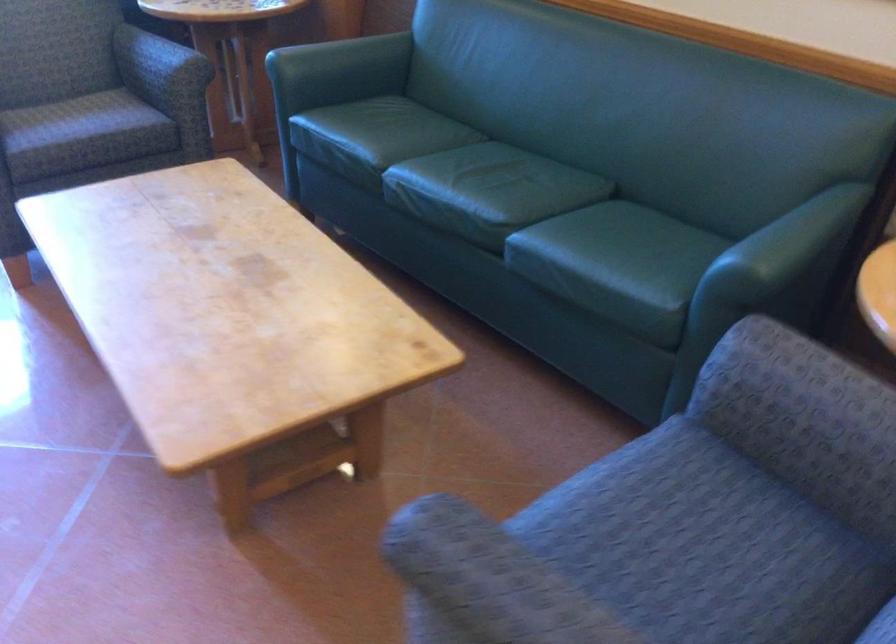
The height and width of the screenshot is (644, 896). Find the location of `green sofa sitting surface`. green sofa sitting surface is located at coordinates (374, 137).